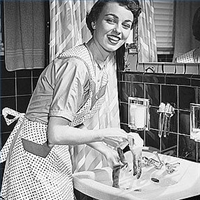
You are a GUI agent. You are given a task and a screenshot of the screen. Output one action in this format:
    pyautogui.click(x=<x>, y=<y>)
    Task: Click on the sink taps
    The width and height of the screenshot is (200, 200).
    Given the screenshot: What is the action you would take?
    pyautogui.click(x=169, y=167), pyautogui.click(x=146, y=160)